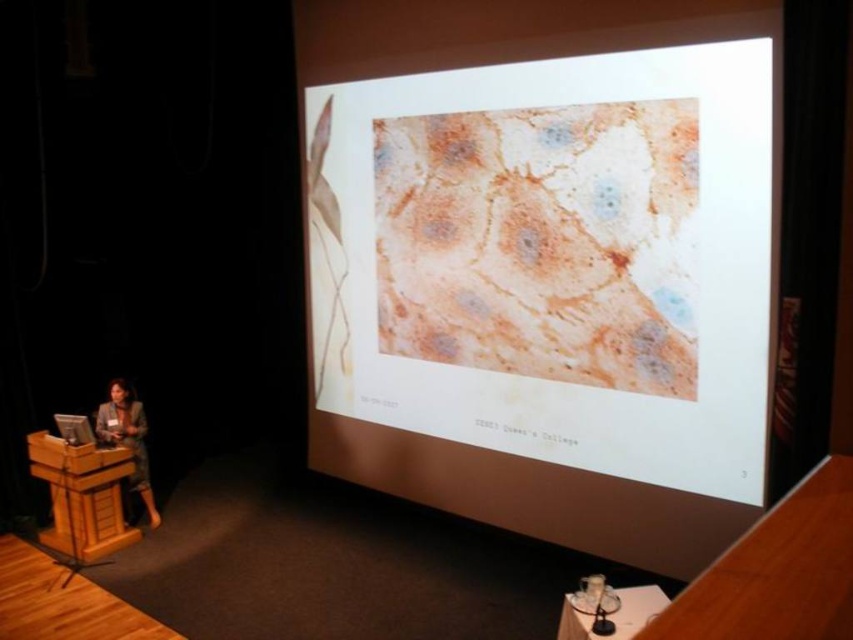
Where is `matte paper slide at center`? The height and width of the screenshot is (640, 853). matte paper slide at center is located at coordinates (544, 260).

Does matte paper slide at center appear under matte black suit at lower left?

Incorrect, matte paper slide at center is not positioned below matte black suit at lower left.

In order to click on matte paper slide at center in this screenshot , I will do `click(544, 260)`.

Does point (346, 416) come in front of point (55, 481)?

No.

What are the coordinates of `matte paper slide at center` in the screenshot? It's located at (544, 260).

Does point (387, 20) come behind point (56, 500)?

Yes, it is behind point (56, 500).

You are a GUI agent. You are given a task and a screenshot of the screen. Output one action in this format:
    pyautogui.click(x=<x>, y=<y>)
    Task: Click on the matte paper slide at center
    
    Given the screenshot: What is the action you would take?
    tap(544, 260)

Does point (70, 490) lie behind point (115, 387)?

No.

Who is more forward, (90, 497) or (128, 392)?

Point (90, 497)

Locate an element on the screen. wooden podium at lower left is located at coordinates point(82,496).